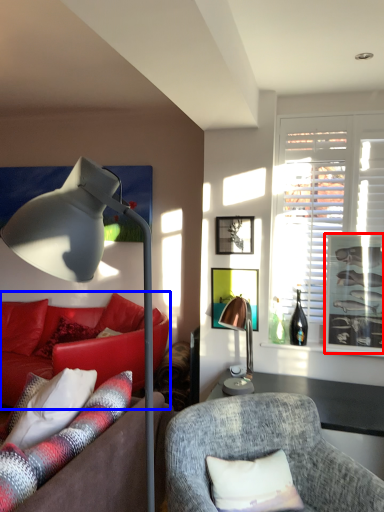
Question: Among these objects, which one is farthest to the camera, picture frame (highlighted by a red box) or studio couch (highlighted by a blue box)?

Choices:
 (A) picture frame
 (B) studio couch

Answer: (B)